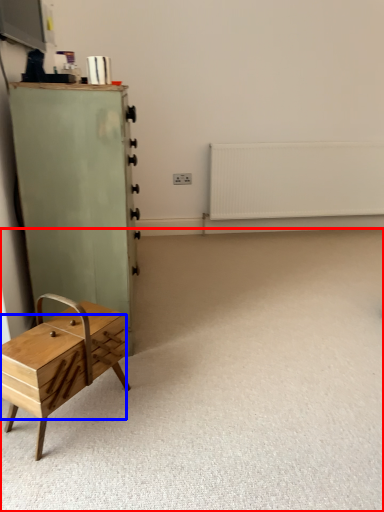
Question: Among these objects, which one is nearest to the camera, plain (highlighted by a red box) or drawer (highlighted by a blue box)?

Choices:
 (A) plain
 (B) drawer

Answer: (A)